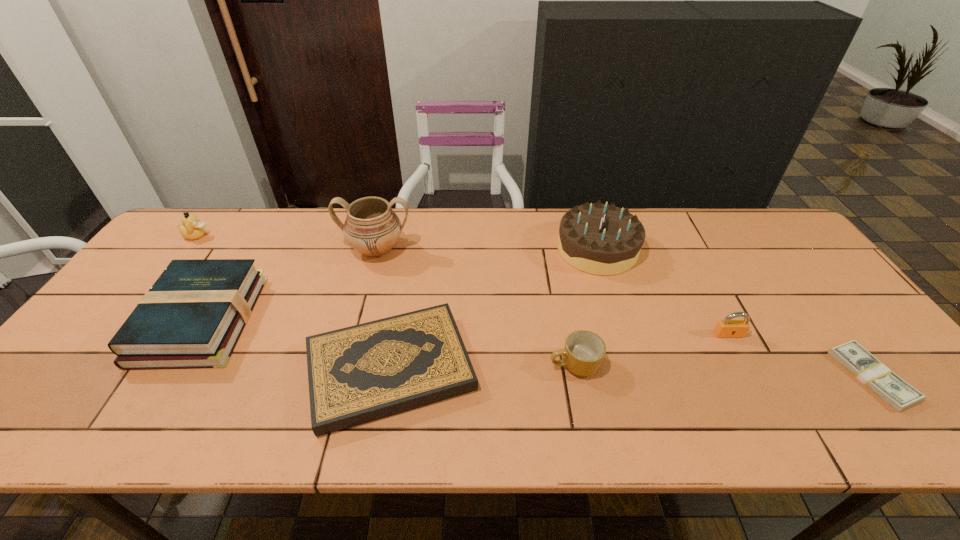
The image size is (960, 540). In order to click on object that is at the right edge in this screenshot , I will do `click(897, 393)`.

Locate an element on the screen. The width and height of the screenshot is (960, 540). object positioned at the far left corner is located at coordinates (192, 228).

This screenshot has height=540, width=960. Identify the location of object situated at the near right corner. (897, 393).

You are a GUI agent. You are given a task and a screenshot of the screen. Output one action in this format:
    pyautogui.click(x=<x>, y=<y>)
    Task: Click on the free space at the far edge of the desktop
    This screenshot has height=540, width=960.
    Given the screenshot: What is the action you would take?
    pyautogui.click(x=647, y=237)

The width and height of the screenshot is (960, 540). In order to click on vacant point at the near edge in this screenshot , I will do `click(517, 403)`.

In the image, there is a desktop. Identify the location of vacant space at the left edge. (84, 341).

The width and height of the screenshot is (960, 540). Identify the location of vacant space at the far right corner of the desktop. (730, 216).

The image size is (960, 540). Find the location of `empty space between the mug and the leftmost object`. empty space between the mug and the leftmost object is located at coordinates (386, 300).

This screenshot has width=960, height=540. What are the coordinates of `free point between the duckling and the mug` in the screenshot? It's located at (386, 300).

Locate an element on the screen. vacant space that is in between the padlock and the leftmost object is located at coordinates (463, 285).